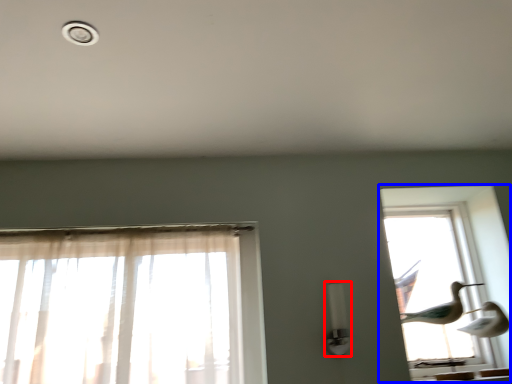
Question: Which object is further to the camera taking this photo, light fixture (highlighted by a red box) or window (highlighted by a blue box)?

Choices:
 (A) light fixture
 (B) window

Answer: (B)